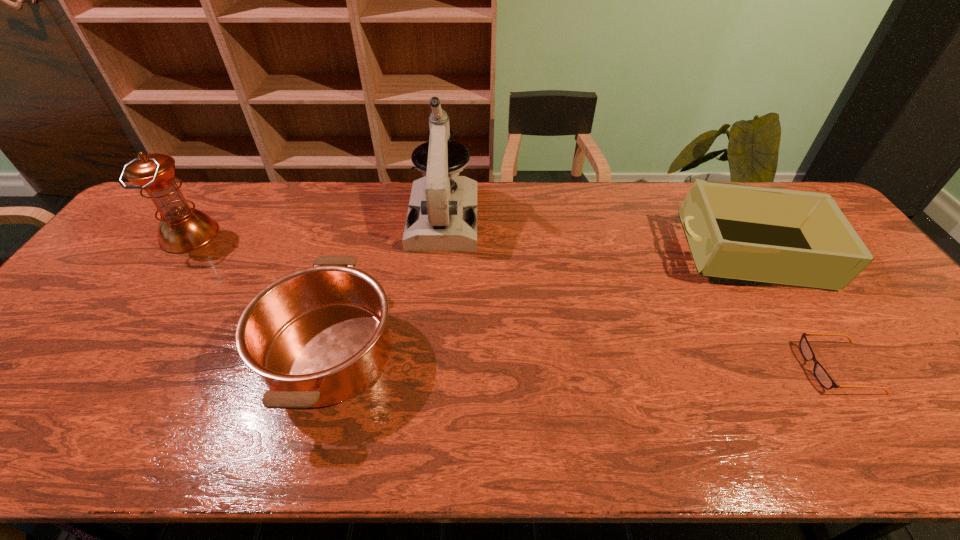
The image size is (960, 540). I want to click on object situated at the far right corner, so click(785, 237).

You are a GUI agent. You are given a task and a screenshot of the screen. Output one action in this format:
    pyautogui.click(x=<x>, y=<y>)
    Task: Click on the blank space at the far edge of the desktop
    
    Given the screenshot: What is the action you would take?
    pyautogui.click(x=274, y=218)

This screenshot has width=960, height=540. What are the coordinates of `free space at the near edge of the desktop` in the screenshot? It's located at (58, 417).

In the image, there is a desktop. Where is `free space at the right edge`? This screenshot has width=960, height=540. free space at the right edge is located at coordinates (954, 390).

The width and height of the screenshot is (960, 540). Find the location of `free space between the second shortest object and the box`. free space between the second shortest object and the box is located at coordinates coord(539,304).

You are a GUI agent. You are given a task and a screenshot of the screen. Output one action in this format:
    pyautogui.click(x=<x>, y=<y>)
    Task: Click on the free spot between the leftmost object and the spectacles
    The image size is (960, 540).
    Given the screenshot: What is the action you would take?
    pyautogui.click(x=514, y=302)

Where is `unoccupied area between the spectacles and the box`? unoccupied area between the spectacles and the box is located at coordinates (793, 312).

You are a GUI agent. You are given a task and a screenshot of the screen. Output one action in this format:
    pyautogui.click(x=<x>, y=<y>)
    Task: Click on the vacant point located between the shortest object and the saucepan
    
    Given the screenshot: What is the action you would take?
    pyautogui.click(x=584, y=360)

Find the location of a particular element. This screenshot has width=960, height=540. vacant point located between the oil lamp and the tallest object is located at coordinates (317, 226).

Identify the location of vacant area that lies between the third tallest object and the second shortest object. The height and width of the screenshot is (540, 960). (539, 304).